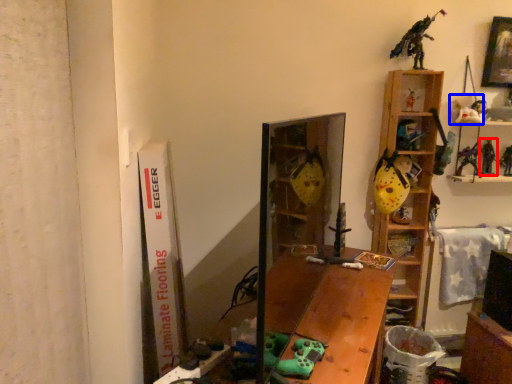
Question: Which object is closer to the camera taking this photo, toy (highlighted by a red box) or toy (highlighted by a blue box)?

Choices:
 (A) toy
 (B) toy

Answer: (B)